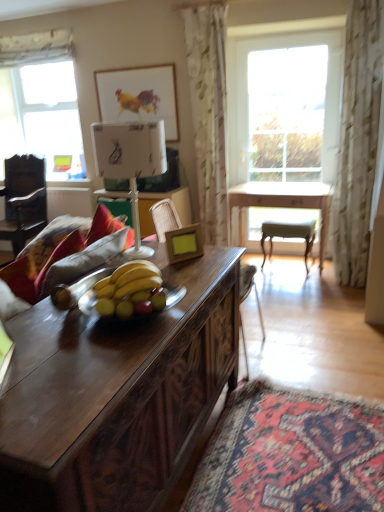
Identify the location of empty space that is ontop of clear glass window at center, the first window from the front (from a real-world perspective). Image resolution: width=384 pixels, height=512 pixels. (292, 30).